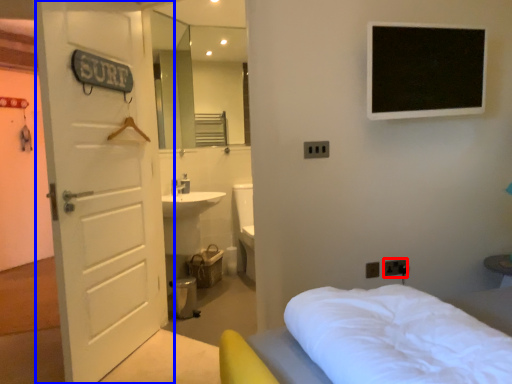
Question: Which of the following is the farthest to the observer, electric outlet (highlighted by a red box) or door (highlighted by a blue box)?

Choices:
 (A) electric outlet
 (B) door

Answer: (A)